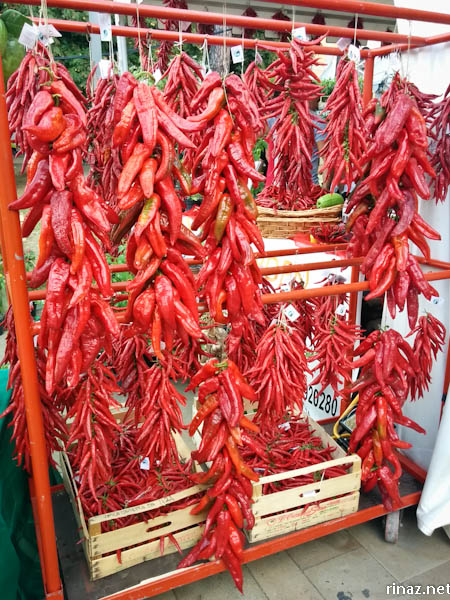
Locate an element on the screen. The image size is (450, 600). wooden basket of pepper is located at coordinates (292, 218).